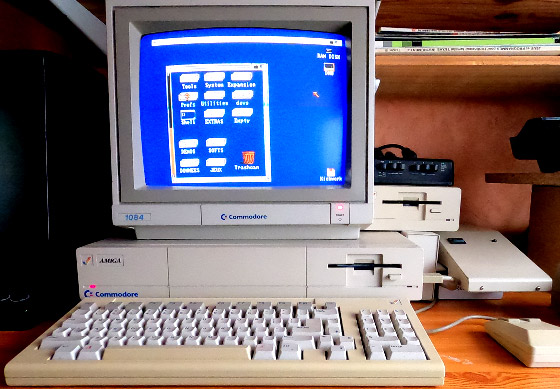
This screenshot has width=560, height=389. Find the location of `mouse`. mouse is located at coordinates (516, 333).